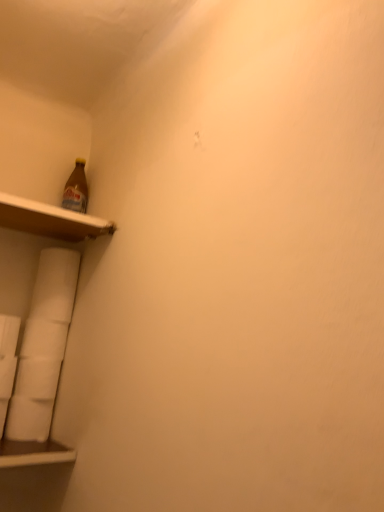
Question: From the image's perspective, is white matte toilet paper at lower left, placed as the 1th toilet paper when sorted from top to bottom, located beneath wooden shelf at upper left?

Choices:
 (A) no
 (B) yes

Answer: (B)

Question: Considering the relative sizes of white matte toilet paper at lower left, placed as the 1th toilet paper when sorted from top to bottom, and wooden shelf at upper left in the image provided, is white matte toilet paper at lower left, placed as the 1th toilet paper when sorted from top to bottom, shorter than wooden shelf at upper left?

Choices:
 (A) no
 (B) yes

Answer: (A)

Question: Considering the relative positions of white matte toilet paper at lower left, the fourth toilet paper from the bottom, and wooden shelf at upper left in the image provided, is white matte toilet paper at lower left, the fourth toilet paper from the bottom, to the left of wooden shelf at upper left from the viewer's perspective?

Choices:
 (A) yes
 (B) no

Answer: (B)

Question: Is white matte toilet paper at lower left, the fourth toilet paper from the bottom, bigger than wooden shelf at upper left?

Choices:
 (A) no
 (B) yes

Answer: (A)

Question: Is the surface of white matte toilet paper at lower left, placed as the 1th toilet paper when sorted from top to bottom, in direct contact with wooden shelf at upper left?

Choices:
 (A) no
 (B) yes

Answer: (A)

Question: Is point (29, 330) closer or farther from the camera than point (26, 409)?

Choices:
 (A) farther
 (B) closer

Answer: (A)

Question: From the image's perspective, is white matte toilet paper at lower left, the second toilet paper positioned from the top, located above or below white matte toilet paper at lower left, the 1th toilet paper positioned from the bottom?

Choices:
 (A) below
 (B) above

Answer: (B)

Question: In terms of width, does white matte toilet paper at lower left, which appears as the third toilet paper when ordered from the bottom, look wider or thinner when compared to white matte toilet paper at lower left, the 1th toilet paper positioned from the bottom?

Choices:
 (A) thin
 (B) wide

Answer: (A)

Question: Based on their positions, is white matte toilet paper at lower left, which appears as the third toilet paper when ordered from the bottom, located to the left or right of white matte toilet paper at lower left, the fourth toilet paper in the top-to-bottom sequence?

Choices:
 (A) left
 (B) right

Answer: (B)

Question: Is white matte toilet paper at lower left, the 1th toilet paper positioned from the bottom, in front of or behind white matte toilet paper at lower left, placed as the 1th toilet paper when sorted from top to bottom, in the image?

Choices:
 (A) front
 (B) behind

Answer: (A)

Question: Do you think white matte toilet paper at lower left, the fourth toilet paper in the top-to-bottom sequence, is within white matte toilet paper at lower left, the fourth toilet paper from the bottom, or outside of it?

Choices:
 (A) inside
 (B) outside

Answer: (B)

Question: Considering the positions of white matte toilet paper at lower left, the 1th toilet paper positioned from the bottom, and white matte toilet paper at lower left, placed as the 1th toilet paper when sorted from top to bottom, in the image, is white matte toilet paper at lower left, the 1th toilet paper positioned from the bottom, wider or thinner than white matte toilet paper at lower left, placed as the 1th toilet paper when sorted from top to bottom,?

Choices:
 (A) wide
 (B) thin

Answer: (A)

Question: Considering the positions of white matte toilet paper at lower left, the fourth toilet paper in the top-to-bottom sequence, and white matte toilet paper at lower left, placed as the 1th toilet paper when sorted from top to bottom, in the image, is white matte toilet paper at lower left, the fourth toilet paper in the top-to-bottom sequence, bigger or smaller than white matte toilet paper at lower left, placed as the 1th toilet paper when sorted from top to bottom,?

Choices:
 (A) small
 (B) big

Answer: (B)

Question: Do you think white matte toilet paper at lower left, which is the 2th toilet paper from bottom to top, is within wooden shelf at upper left, or outside of it?

Choices:
 (A) outside
 (B) inside

Answer: (A)

Question: From a real-world perspective, is white matte toilet paper at lower left, the 3th toilet paper when ordered from top to bottom, above or below wooden shelf at upper left?

Choices:
 (A) below
 (B) above

Answer: (A)